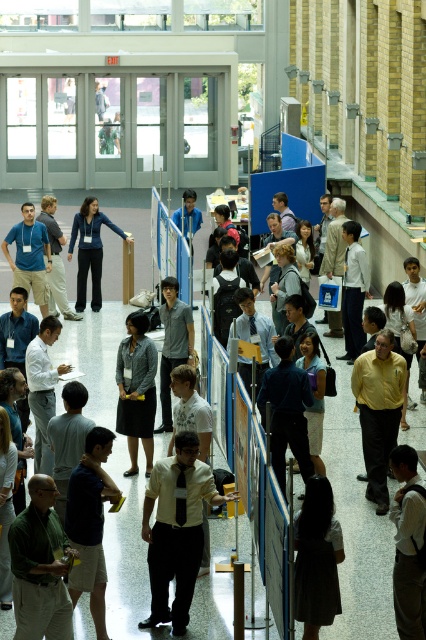
Does gray fabric skirt at center appear on the left side of matte blue jacket at center?

Incorrect, gray fabric skirt at center is not on the left side of matte blue jacket at center.

Between gray fabric skirt at center and matte blue jacket at center, which one appears on the right side from the viewer's perspective?

Positioned to the right is gray fabric skirt at center.

At what (x,y) coordinates should I click in order to perform the action: click on gray fabric skirt at center. Please return your answer as a coordinate pair (x, y). The height and width of the screenshot is (640, 426). Looking at the image, I should click on (137, 388).